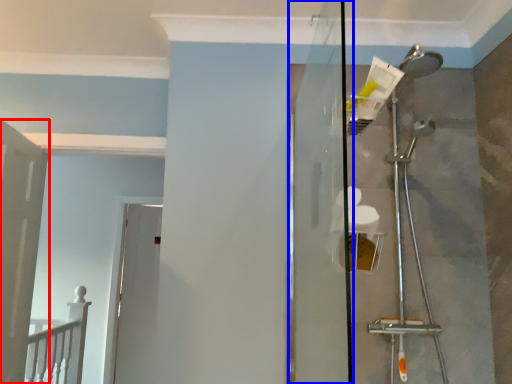
Question: Which point is closer to the camera, door (highlighted by a red box) or screen door (highlighted by a blue box)?

Choices:
 (A) door
 (B) screen door

Answer: (B)